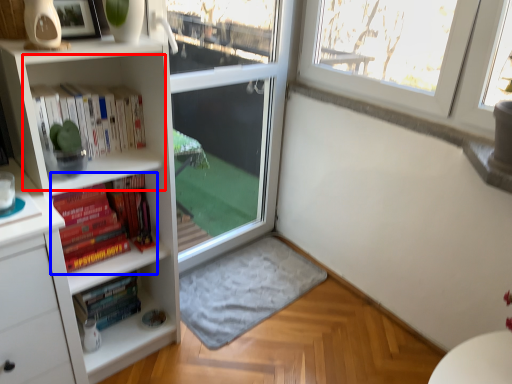
Question: Which of the following is the closest to the observer, cabinet (highlighted by a red box) or book (highlighted by a blue box)?

Choices:
 (A) cabinet
 (B) book

Answer: (A)